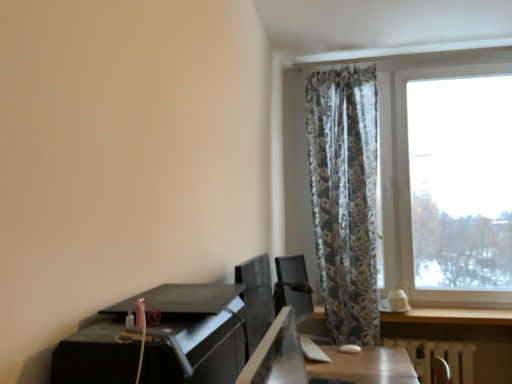
Describe the element at coordinates (161, 340) in the screenshot. I see `black glossy desk at lower left` at that location.

What do you see at coordinates (438, 356) in the screenshot? I see `white textured radiator at lower right` at bounding box center [438, 356].

What do you see at coordinates (277, 355) in the screenshot? I see `satin black monitor at center` at bounding box center [277, 355].

Where is `transparent glass window at right`? transparent glass window at right is located at coordinates (451, 316).

Considering the relative sizes of black glossy desk at lower left and white textured radiator at lower right in the image provided, is black glossy desk at lower left shorter than white textured radiator at lower right?

Correct, black glossy desk at lower left is not as tall as white textured radiator at lower right.

Which is behind, point (211, 331) or point (426, 353)?

The point (426, 353) is behind.

Could you tell me if black glossy desk at lower left is turned towards white textured radiator at lower right?

No, black glossy desk at lower left does not turn towards white textured radiator at lower right.

Does white textured radiator at lower right have a lesser height compared to transparent glass window at right?

In fact, white textured radiator at lower right may be taller than transparent glass window at right.

This screenshot has width=512, height=384. I want to click on radiator located underneath the transparent glass window at right (from a real-world perspective), so click(438, 356).

Considering the sizes of objects white textured radiator at lower right and transparent glass window at right in the image provided, who is wider, white textured radiator at lower right or transparent glass window at right?

With larger width is transparent glass window at right.

Is white textured radiator at lower right beside transparent glass window at right?

No.

Does black glossy desk at lower left have a smaller size compared to satin black monitor at center?

No.

Is satin black monitor at center surrounded by black glossy desk at lower left?

No, satin black monitor at center is not surrounded by black glossy desk at lower left.

Considering the sizes of objects black glossy desk at lower left and satin black monitor at center in the image provided, who is shorter, black glossy desk at lower left or satin black monitor at center?

→ satin black monitor at center.

Considering the positions of objects black glossy desk at lower left and satin black monitor at center in the image provided, who is more to the right, black glossy desk at lower left or satin black monitor at center?

Positioned to the right is satin black monitor at center.

Would you say white textured radiator at lower right is a long distance from satin black monitor at center?

Yes.

Considering the relative sizes of white textured radiator at lower right and satin black monitor at center in the image provided, is white textured radiator at lower right shorter than satin black monitor at center?

No, white textured radiator at lower right is not shorter than satin black monitor at center.

Is white textured radiator at lower right to the left of satin black monitor at center from the viewer's perspective?

No, white textured radiator at lower right is not to the left of satin black monitor at center.

Can you tell me how much white textured radiator at lower right and satin black monitor at center differ in facing direction?

The angular difference between white textured radiator at lower right and satin black monitor at center is 92.1 degrees.

From the picture: Which is closer to the camera, (402,343) or (166,345)?

Clearly, point (402,343) is more distant from the camera than point (166,345).

Consider the image. From the image's perspective, is white textured radiator at lower right located beneath black glossy desk at lower left?

Correct, white textured radiator at lower right appears lower than black glossy desk at lower left in the image.

Is white textured radiator at lower right to the left or to the right of black glossy desk at lower left in the image?

Clearly, white textured radiator at lower right is on the right of black glossy desk at lower left in the image.

Based on their sizes in the image, would you say satin black monitor at center is bigger or smaller than transparent glass window at right?

Considering their sizes, satin black monitor at center takes up less space than transparent glass window at right.

Which object is positioned more to the right, satin black monitor at center or transparent glass window at right?

From the viewer's perspective, transparent glass window at right appears more on the right side.

From the picture: Could you tell me if satin black monitor at center is facing transparent glass window at right?

No, satin black monitor at center is not oriented towards transparent glass window at right.

Would you say satin black monitor at center contains transparent glass window at right?

No, transparent glass window at right is located outside of satin black monitor at center.

This screenshot has height=384, width=512. Find the location of `desk behind the satin black monitor at center`. desk behind the satin black monitor at center is located at coordinates (161, 340).

Between satin black monitor at center and black glossy desk at lower left, which one is positioned in front?

Positioned in front is satin black monitor at center.

In the scene shown: From the image's perspective, which one is positioned higher, satin black monitor at center or black glossy desk at lower left?

black glossy desk at lower left.

How many degrees apart are the facing directions of satin black monitor at center and black glossy desk at lower left?

1.14 degrees.

You are a GUI agent. You are given a task and a screenshot of the screen. Output one action in this format:
    pyautogui.click(x=<x>, y=<y>)
    Task: Click on the radiator behind the black glossy desk at lower left
    
    Given the screenshot: What is the action you would take?
    pyautogui.click(x=438, y=356)

Image resolution: width=512 pixels, height=384 pixels. What are the coordinates of `window above the white textured radiator at lower right (from a real-world perspective)` in the screenshot? It's located at (451, 316).

Considering their positions, is satin black monitor at center positioned further to black glossy desk at lower left than transparent glass window at right?

transparent glass window at right is further to black glossy desk at lower left.

Looking at the image, which one is located closer to satin black monitor at center, black glossy desk at lower left or transparent glass window at right?

black glossy desk at lower left lies closer to satin black monitor at center than the other object.

Considering their positions, is satin black monitor at center positioned further to white textured radiator at lower right than black glossy desk at lower left?

black glossy desk at lower left.

Considering their positions, is transparent glass window at right positioned closer to white textured radiator at lower right than satin black monitor at center?

Based on the image, transparent glass window at right appears to be nearer to white textured radiator at lower right.

From the image, which object appears to be nearer to satin black monitor at center, transparent glass window at right or black glossy desk at lower left?

black glossy desk at lower left is positioned closer to the anchor satin black monitor at center.

When comparing their distances from black glossy desk at lower left, does transparent glass window at right or satin black monitor at center seem further?

The object further to black glossy desk at lower left is transparent glass window at right.

Based on their spatial positions, is white textured radiator at lower right or transparent glass window at right closer to black glossy desk at lower left?

transparent glass window at right lies closer to black glossy desk at lower left than the other object.

Based on the photo, estimate the real-world distances between objects in this image. Which object is further from white textured radiator at lower right, black glossy desk at lower left or transparent glass window at right?

black glossy desk at lower left lies further to white textured radiator at lower right than the other object.

In order to click on desk positioned between satin black monitor at center and transparent glass window at right from near to far in this screenshot , I will do `click(161, 340)`.

Where is `window between black glossy desk at lower left and white textured radiator at lower right along the z-axis`? The width and height of the screenshot is (512, 384). window between black glossy desk at lower left and white textured radiator at lower right along the z-axis is located at coordinates (451, 316).

The height and width of the screenshot is (384, 512). Find the location of `window located between satin black monitor at center and white textured radiator at lower right in the depth direction`. window located between satin black monitor at center and white textured radiator at lower right in the depth direction is located at coordinates (451, 316).

You are a GUI agent. You are given a task and a screenshot of the screen. Output one action in this format:
    pyautogui.click(x=<x>, y=<y>)
    Task: Click on the desk between satin black monitor at center and white textured radiator at lower right along the z-axis
    This screenshot has height=384, width=512.
    Given the screenshot: What is the action you would take?
    [x=161, y=340]